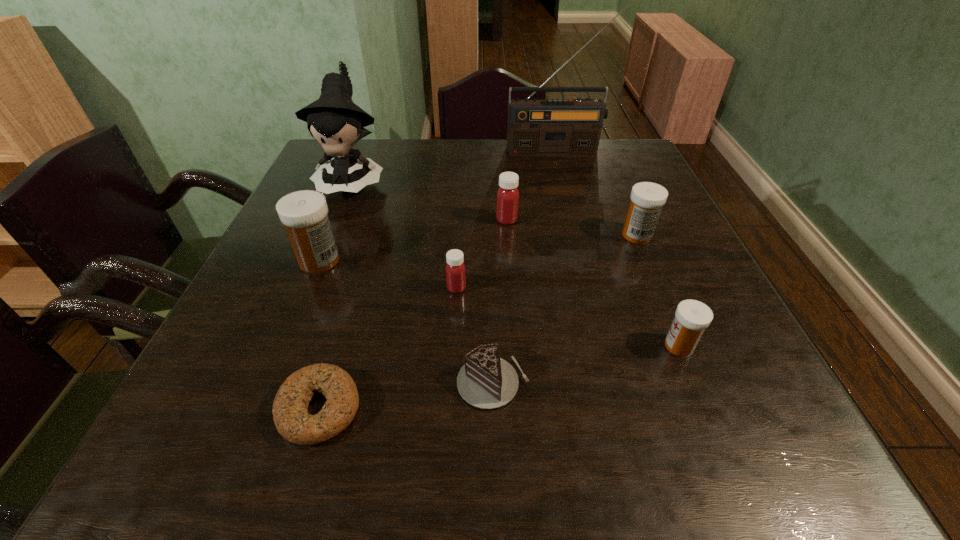
You are a GUI agent. You are given a task and a screenshot of the screen. Output one action in this format:
    pyautogui.click(x=<x>, y=<y>)
    Task: Click on the vacant area located on the left of the right red medicine
    This screenshot has width=960, height=540.
    Given the screenshot: What is the action you would take?
    pyautogui.click(x=418, y=220)

I want to click on blank area located 0.280m on the left of the fourth farthest medicine, so click(x=309, y=288).

Identify the location of free space located 0.120m on the left of the smallest white medicine. The width and height of the screenshot is (960, 540). (596, 346).

What are the coordinates of `free space located 0.090m on the front of the chocolate cake` in the screenshot? It's located at (495, 468).

The height and width of the screenshot is (540, 960). Identify the location of free space located on the back of the shortest object. (364, 258).

Image resolution: width=960 pixels, height=540 pixels. Find the location of `radio receiver that is at the far edge`. radio receiver that is at the far edge is located at coordinates (536, 127).

Identify the location of doll that is at the far edge. The width and height of the screenshot is (960, 540). (333, 120).

Locate an element on the screen. Image resolution: width=960 pixels, height=540 pixels. object present at the near edge is located at coordinates (290, 412).

This screenshot has width=960, height=540. Find the location of `doll located in the left edge section of the desktop`. doll located in the left edge section of the desktop is located at coordinates (x=333, y=120).

Identify the location of medicine positioned at the left edge. (304, 213).